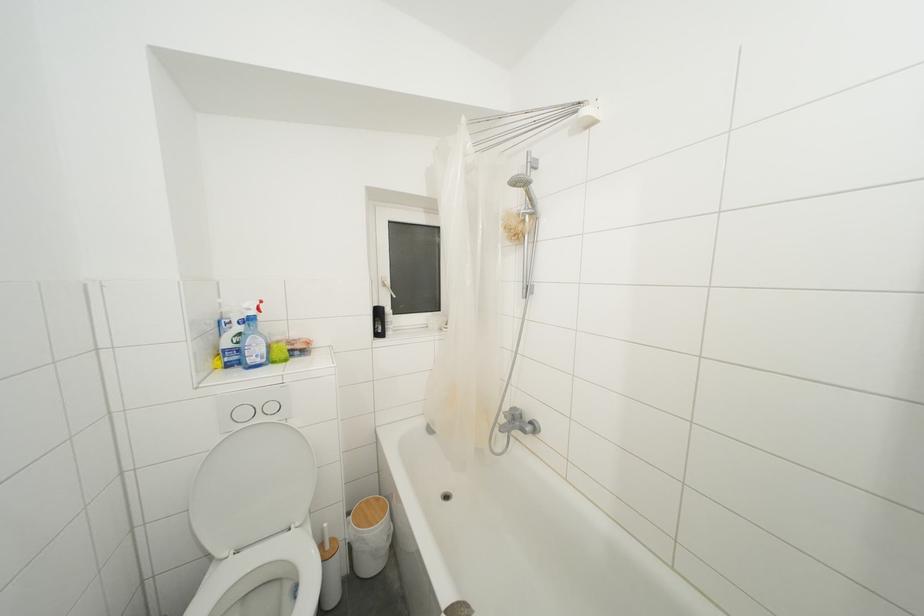
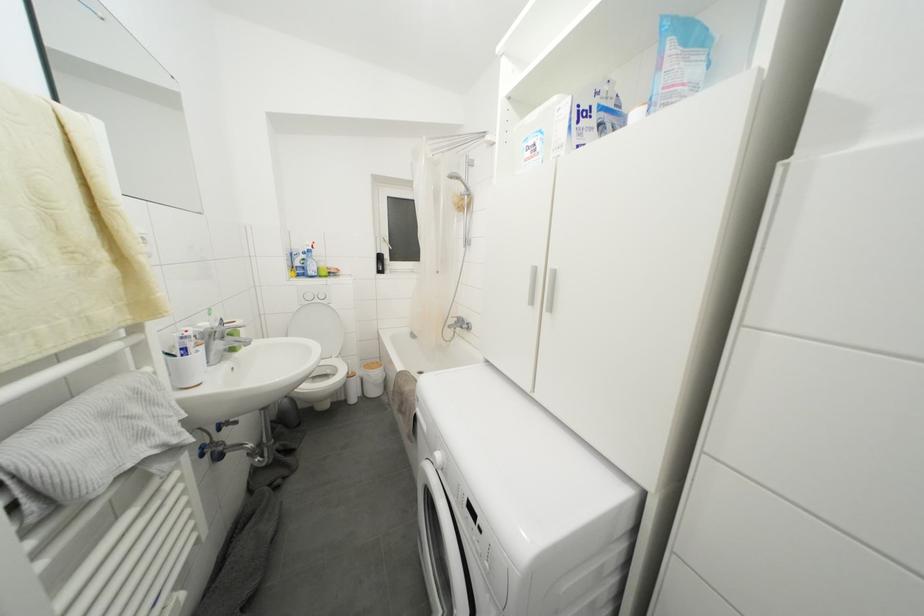
Where in the second image is the point corresponding to point (244, 339) from the first image?

(308, 264)